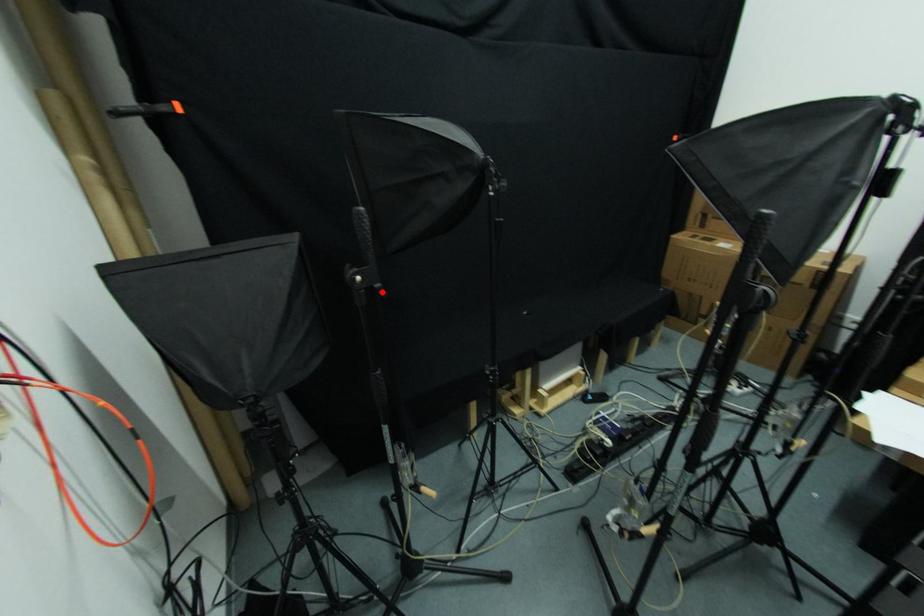
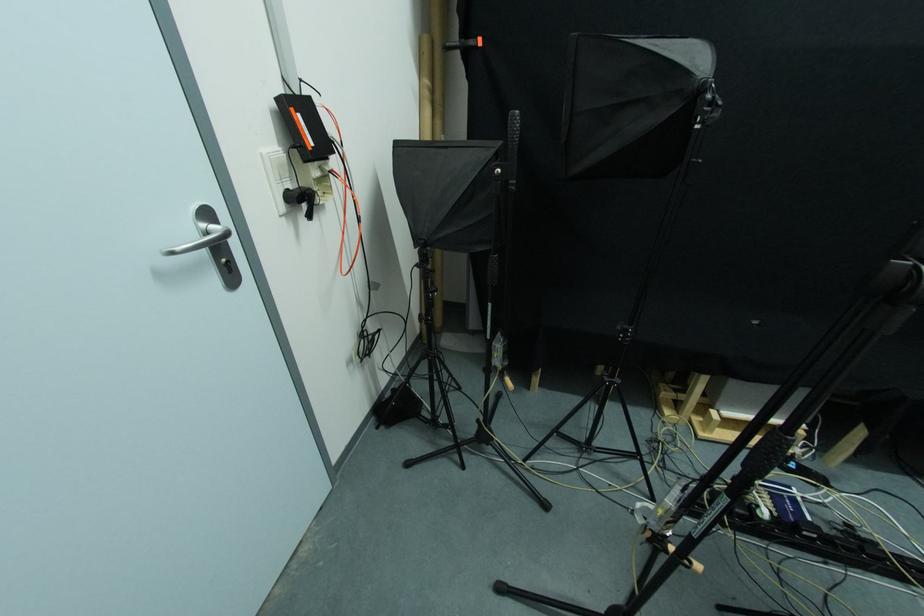
Find the pixel in the second image that matches the highlighted location in the first image.

(515, 187)